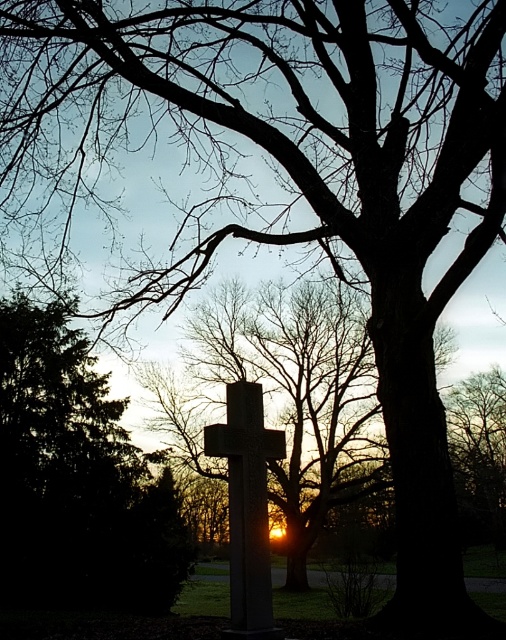
Which of these two, green leafy tree at left or smooth stone cross at center, stands taller?

smooth stone cross at center is taller.

Between point (30, 529) and point (270, 589), which one is positioned in front?

Point (270, 589) is more forward.

You are a GUI agent. You are given a task and a screenshot of the screen. Output one action in this format:
    pyautogui.click(x=<x>, y=<y>)
    Task: Click on the green leafy tree at left
    The width and height of the screenshot is (506, 640).
    Given the screenshot: What is the action you would take?
    pyautogui.click(x=76, y=480)

Where is `green leafy tree at left`? green leafy tree at left is located at coordinates (76, 480).